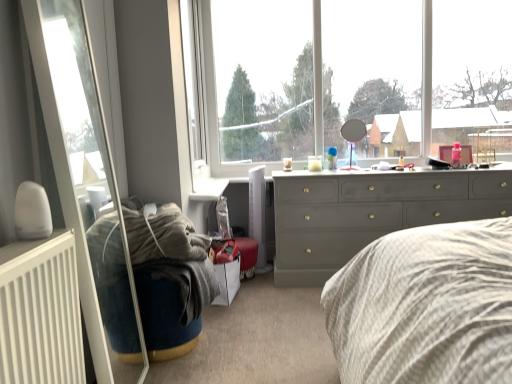
Question: From a real-world perspective, is transparent glass mirror at upper center under transparent glass door at left?

Choices:
 (A) no
 (B) yes

Answer: (A)

Question: From a real-world perspective, is transparent glass mirror at upper center physically above transparent glass door at left?

Choices:
 (A) no
 (B) yes

Answer: (B)

Question: Is transparent glass mirror at upper center positioned behind transparent glass door at left?

Choices:
 (A) no
 (B) yes

Answer: (B)

Question: Is transparent glass mirror at upper center bigger than transparent glass door at left?

Choices:
 (A) yes
 (B) no

Answer: (A)

Question: From the image's perspective, is transparent glass mirror at upper center above transparent glass door at left?

Choices:
 (A) no
 (B) yes

Answer: (B)

Question: From the image's perspective, does transparent glass mirror at upper center appear lower than transparent glass door at left?

Choices:
 (A) yes
 (B) no

Answer: (B)

Question: Considering the relative sizes of matte gray dresser at center and transparent glass door at left in the image provided, is matte gray dresser at center shorter than transparent glass door at left?

Choices:
 (A) no
 (B) yes

Answer: (B)

Question: From the image's perspective, is matte gray dresser at center below transparent glass door at left?

Choices:
 (A) yes
 (B) no

Answer: (A)

Question: Is matte gray dresser at center with transparent glass door at left?

Choices:
 (A) yes
 (B) no

Answer: (B)

Question: Does matte gray dresser at center have a lesser width compared to transparent glass door at left?

Choices:
 (A) no
 (B) yes

Answer: (A)

Question: Is matte gray dresser at center at the left side of transparent glass door at left?

Choices:
 (A) no
 (B) yes

Answer: (A)

Question: Can you confirm if matte gray dresser at center is bigger than transparent glass door at left?

Choices:
 (A) yes
 (B) no

Answer: (A)

Question: Does white matte radiator at lower left have a greater width compared to matte gray dresser at center?

Choices:
 (A) yes
 (B) no

Answer: (B)